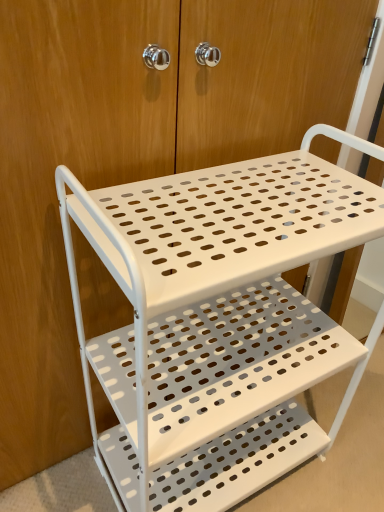
Looking at this image, what is the approximate width of white perforated metal cart at center?

white perforated metal cart at center is 14.90 inches wide.

Where is `white perforated metal cart at center`? This screenshot has height=512, width=384. white perforated metal cart at center is located at coordinates (218, 320).

The height and width of the screenshot is (512, 384). Describe the element at coordinates (218, 320) in the screenshot. I see `white perforated metal cart at center` at that location.

Where is `white perforated metal cart at center`? The height and width of the screenshot is (512, 384). white perforated metal cart at center is located at coordinates (218, 320).